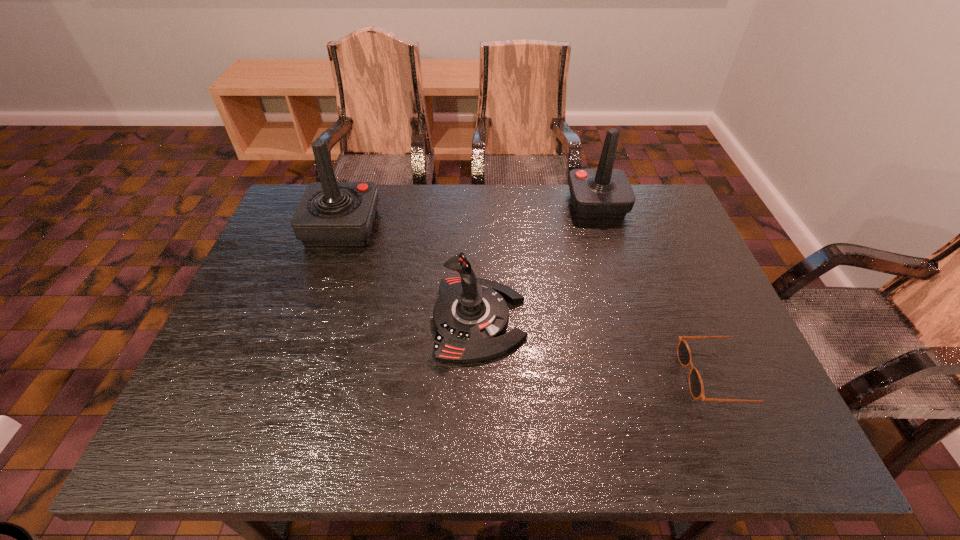
You are a GUI agent. You are given a task and a screenshot of the screen. Output one action in this format:
    pyautogui.click(x=<x>, y=<y>)
    Task: Click on the vacant space located 0.140m on the front-facing side of the sunglasses
    The image size is (960, 540).
    Given the screenshot: What is the action you would take?
    pyautogui.click(x=620, y=376)

Identify the location of object that is at the left edge. (330, 213).

Locate an element on the screen. The image size is (960, 540). joystick that is at the right edge is located at coordinates (604, 192).

This screenshot has width=960, height=540. Identify the location of sunglasses present at the right edge. (696, 387).

Where is `object that is positioned at the far left corner`? object that is positioned at the far left corner is located at coordinates (330, 213).

This screenshot has height=540, width=960. I want to click on object that is at the far right corner, so click(x=604, y=192).

The image size is (960, 540). In order to click on vacant space at the far edge in this screenshot , I will do `click(563, 205)`.

Where is `vacant region at the near edge of the desktop`? Image resolution: width=960 pixels, height=540 pixels. vacant region at the near edge of the desktop is located at coordinates (465, 448).

The height and width of the screenshot is (540, 960). Identify the location of vacant space at the left edge of the desktop. coord(286,324).

Find the location of a particular element. This screenshot has width=960, height=540. vacant space at the right edge of the desktop is located at coordinates (684, 373).